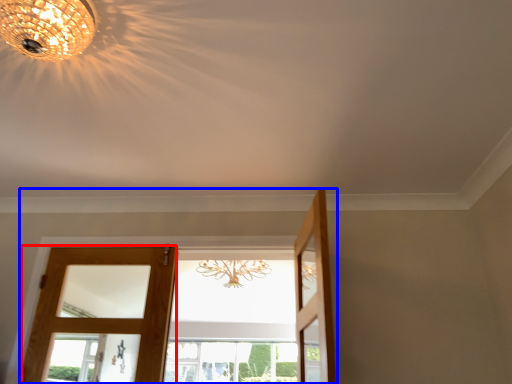
Question: Which object appears closest to the camera in this image, door (highlighted by a red box) or door (highlighted by a blue box)?

Choices:
 (A) door
 (B) door

Answer: (B)